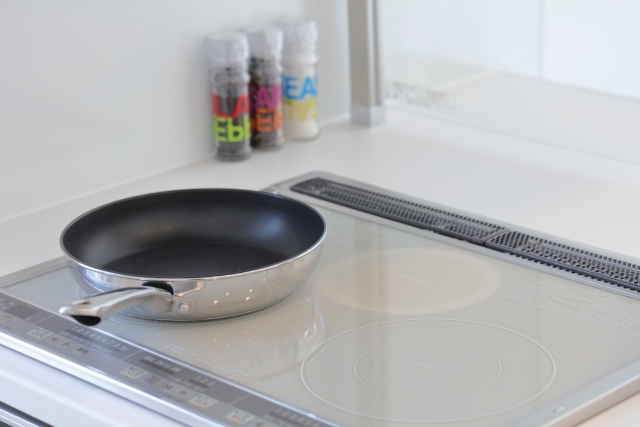
At what (x,y) coordinates should I click in order to perform the action: click on clear space to the left of stove. Please return your answer as a coordinate pair (x, y). Looking at the image, I should click on (34, 235).